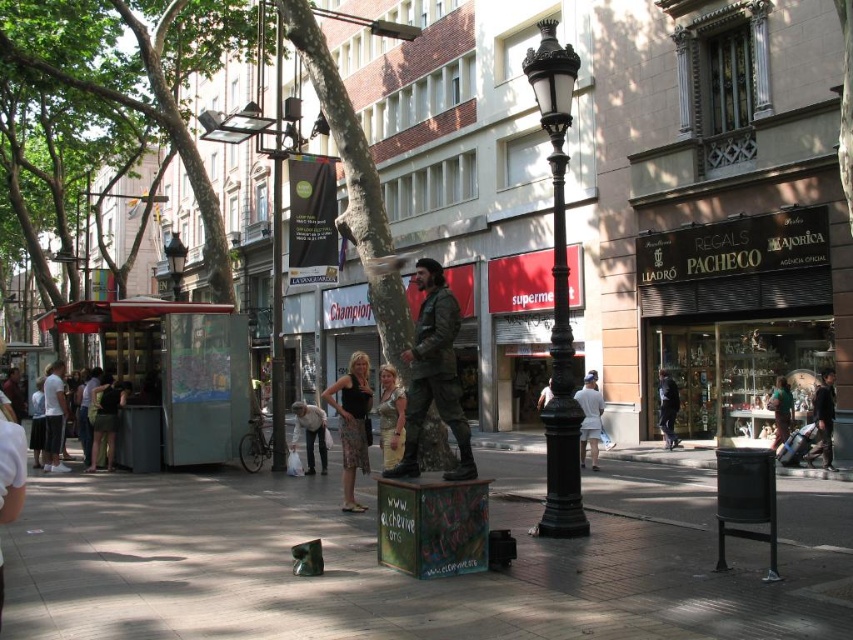
Question: Does black textured dress at center have a greater width compared to denim pants at center?

Choices:
 (A) yes
 (B) no

Answer: (B)

Question: Among these points, which one is nearest to the camera?

Choices:
 (A) (395, 420)
 (B) (407, 400)
 (C) (360, 396)

Answer: (B)

Question: Which object appears farthest from the camera in this image?

Choices:
 (A) dark gray fabric jacket at center
 (B) camouflage fabric statue at center
 (C) dark green fabric jacket at lower left
 (D) black glass storefront at center

Answer: (D)

Question: Which object is closer to the camera taking this photo?

Choices:
 (A) dark green fabric jacket at lower left
 (B) metallic streetlamp at upper center

Answer: (A)

Question: In this image, where is white cotton shorts at center located relative to dark gray fabric jacket at center?

Choices:
 (A) below
 (B) above

Answer: (A)

Question: Is metallic streetlamp at upper center in front of white cotton shorts at center?

Choices:
 (A) no
 (B) yes

Answer: (B)